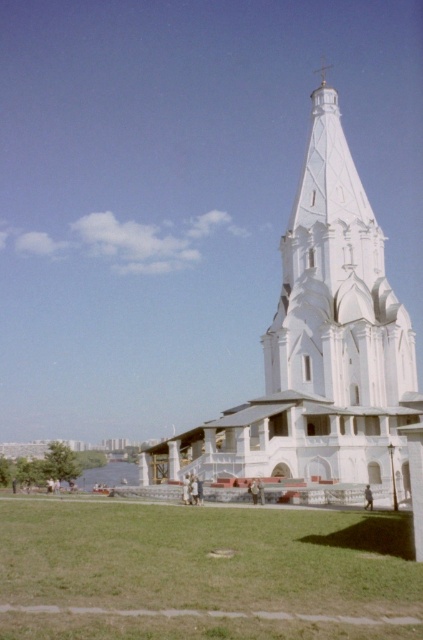
Question: Can you confirm if green grass at lower center is smaller than white smooth church at center?

Choices:
 (A) no
 (B) yes

Answer: (B)

Question: Can you confirm if green grass at lower center is positioned below white smooth church at center?

Choices:
 (A) no
 (B) yes

Answer: (B)

Question: Observing the image, what is the correct spatial positioning of green grass at lower center in reference to white smooth church at center?

Choices:
 (A) left
 (B) right

Answer: (A)

Question: Which of the following is the closest to the observer?

Choices:
 (A) (255, 625)
 (B) (293, 212)

Answer: (A)

Question: Which point is farther to the camera?

Choices:
 (A) (318, 115)
 (B) (52, 625)

Answer: (A)